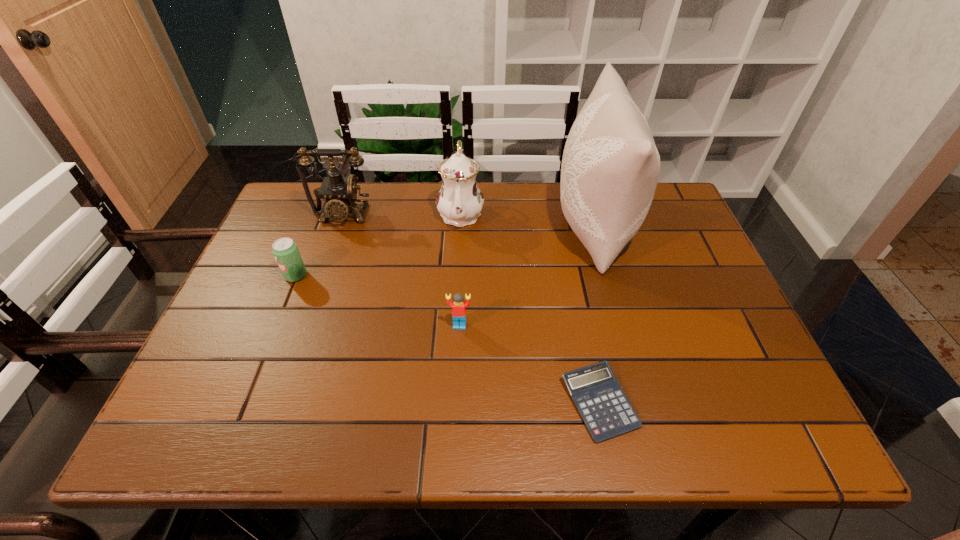
You are a GUI agent. You are given a task and a screenshot of the screen. Output one action in this format:
    pyautogui.click(x=<x>, y=<y>)
    Task: Click on the blank area located on the rotary dial of the telephone
    The height and width of the screenshot is (540, 960).
    Given the screenshot: What is the action you would take?
    pyautogui.click(x=323, y=273)

The width and height of the screenshot is (960, 540). Find the location of `free location located 0.310m on the left of the chinaware`. free location located 0.310m on the left of the chinaware is located at coordinates (331, 213).

Locate an element on the screen. This screenshot has width=960, height=540. vacant area situated on the right of the soda is located at coordinates (419, 275).

The image size is (960, 540). Identify the location of vacant area located 0.130m on the face of the fifth farthest object. (457, 381).

At what (x,y) coordinates should I click in order to perform the action: click on free space located 0.220m on the right of the shortest object. Please return your answer as a coordinate pair (x, y). Looking at the image, I should click on (747, 403).

At what (x,y) coordinates should I click in order to perform the action: click on cushion located in the far edge section of the desktop. Please return your answer as a coordinate pair (x, y). Image resolution: width=960 pixels, height=540 pixels. Looking at the image, I should click on (610, 167).

Locate an element on the screen. The height and width of the screenshot is (540, 960). telephone present at the far edge is located at coordinates (340, 193).

The height and width of the screenshot is (540, 960). Find the location of `chinaware present at the far edge`. chinaware present at the far edge is located at coordinates (459, 201).

At what (x,y) coordinates should I click in order to perform the action: click on object at the near edge. Please return your answer as a coordinate pair (x, y). Looking at the image, I should click on (606, 411).

This screenshot has width=960, height=540. Find the location of `telephone located in the left edge section of the desktop`. telephone located in the left edge section of the desktop is located at coordinates (340, 193).